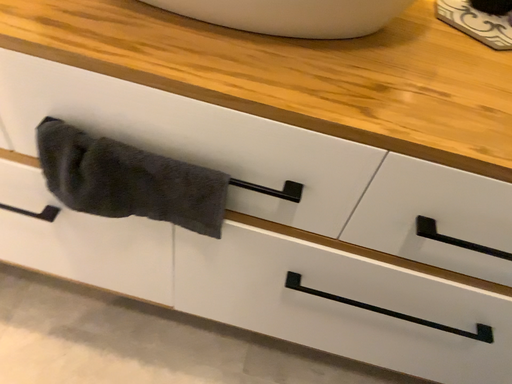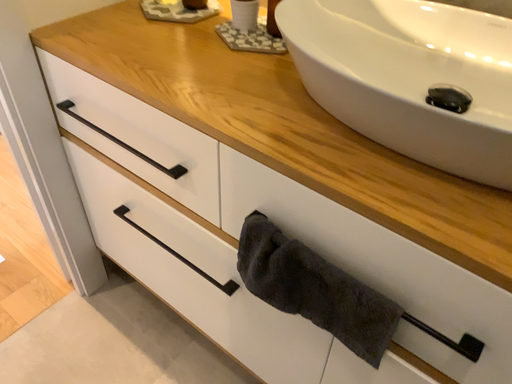
Question: How did the camera likely rotate when shooting the video?

Choices:
 (A) rotated downward
 (B) rotated upward

Answer: (B)